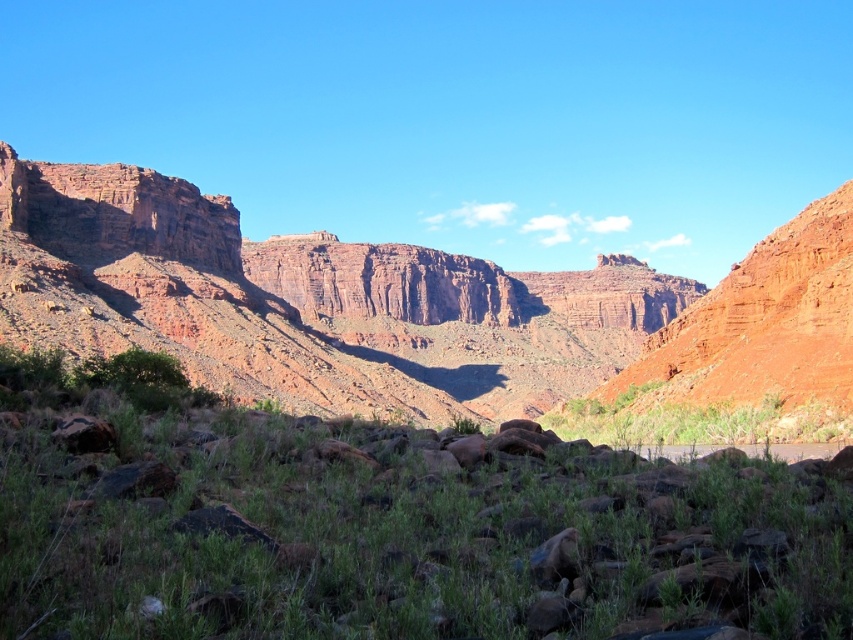
You are standing at the base of the canyon looking up. You see two points marked in the image. The first point is at coordinates point (370,280) and the second is at point (827,440). Which point is closer to your current position?

Point (827,440) is closer to your current position because it is in front of point (370,280) according to the description.

You are standing at the base of the canyon looking up. You notice two green areas in the center of the image. Which one is closer to you, the green grassy at center or the green leafy shrubs at center?

The green grassy at center is closer to you because it is positioned in front of the green leafy shrubs at center.

You are a hiker standing at the base of the rustic rock formation at center and want to reach the green leafy shrubs at center. Given that your average walking pace is 1.5 meters per second, how long will it take you to walk directly to the shrubs?

The distance between the rustic rock formation at center and the green leafy shrubs at center is 49.12 meters. At a walking pace of 1.5 meters per second, it would take approximately 32.75 seconds to reach the shrubs.